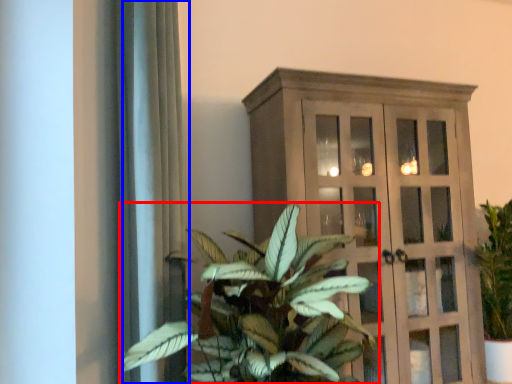
Question: Which of the following is the closest to the observer, houseplant (highlighted by a red box) or curtain (highlighted by a blue box)?

Choices:
 (A) houseplant
 (B) curtain

Answer: (A)